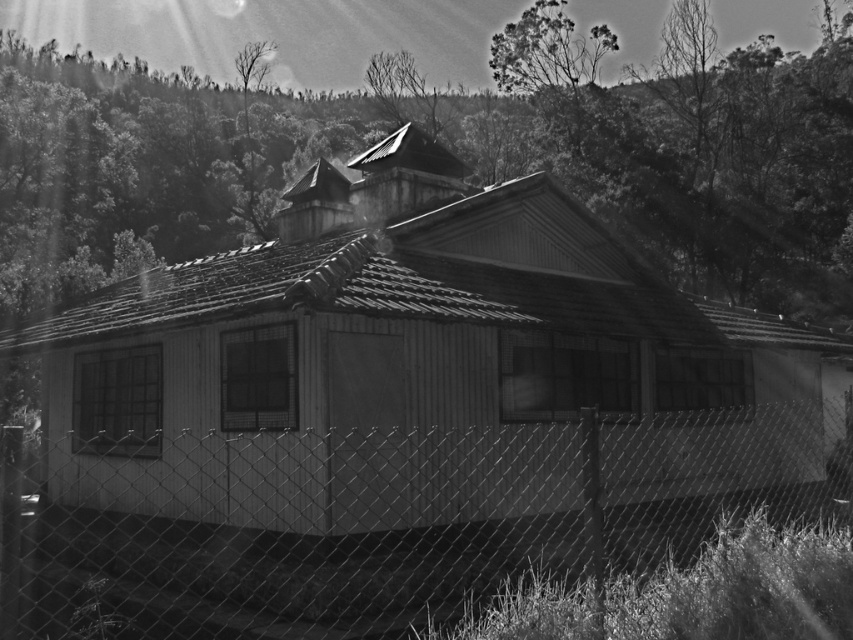
Is point (276, 525) farther from viewer compared to point (381, 604)?

Yes, it is behind point (381, 604).

Between wooden hut at center and wire mesh fence at lower center, which one has more height?

wooden hut at center

Measure the distance between point (397, 412) and camera.

Point (397, 412) is 11.67 meters from camera.

The image size is (853, 640). Find the location of `wooden hut at center`. wooden hut at center is located at coordinates (410, 364).